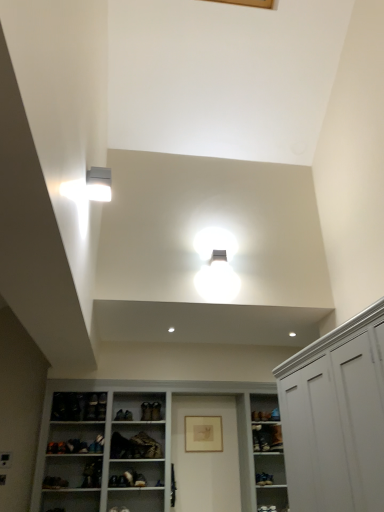
Question: Is white plastic light fixture at upper left taller than matte gold picture frame at center?

Choices:
 (A) no
 (B) yes

Answer: (A)

Question: Does white plastic light fixture at upper left turn towards matte gold picture frame at center?

Choices:
 (A) yes
 (B) no

Answer: (B)

Question: Is white plastic light fixture at upper left outside of matte gold picture frame at center?

Choices:
 (A) yes
 (B) no

Answer: (A)

Question: Considering the relative positions of white plastic light fixture at upper left and matte gold picture frame at center in the image provided, is white plastic light fixture at upper left in front of matte gold picture frame at center?

Choices:
 (A) yes
 (B) no

Answer: (A)

Question: Is white plastic light fixture at upper left facing away from matte gold picture frame at center?

Choices:
 (A) yes
 (B) no

Answer: (B)

Question: Is white plastic light fixture at upper left positioned far away from matte gold picture frame at center?

Choices:
 (A) no
 (B) yes

Answer: (B)

Question: From a real-world perspective, is matte gold picture frame at center over leather at center, acting as the second shoe starting from the right?

Choices:
 (A) yes
 (B) no

Answer: (B)

Question: From the image's perspective, is matte gold picture frame at center above leather at center, the 1th shoe when ordered from left to right?

Choices:
 (A) no
 (B) yes

Answer: (A)

Question: Is matte gold picture frame at center turned away from leather at center, the 1th shoe when ordered from left to right?

Choices:
 (A) yes
 (B) no

Answer: (B)

Question: From a real-world perspective, is matte gold picture frame at center under leather at center, acting as the second shoe starting from the right?

Choices:
 (A) no
 (B) yes

Answer: (B)

Question: Does matte gold picture frame at center lie behind leather at center, the 1th shoe when ordered from left to right?

Choices:
 (A) no
 (B) yes

Answer: (B)

Question: Considering the relative positions of matte gold picture frame at center and leather at center, the 1th shoe when ordered from left to right, in the image provided, is matte gold picture frame at center to the left of leather at center, the 1th shoe when ordered from left to right, from the viewer's perspective?

Choices:
 (A) no
 (B) yes

Answer: (A)

Question: Is white matte cabinet at right located outside leather shoe at center, which is the second shoe from left to right?

Choices:
 (A) no
 (B) yes

Answer: (B)